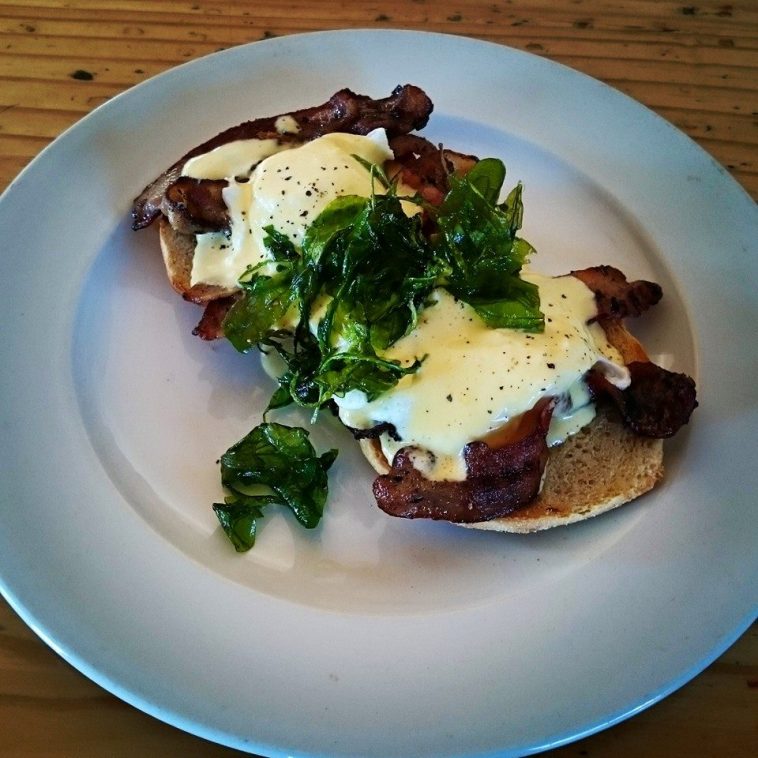
Locate an element on the screen. plate is located at coordinates (86, 556).